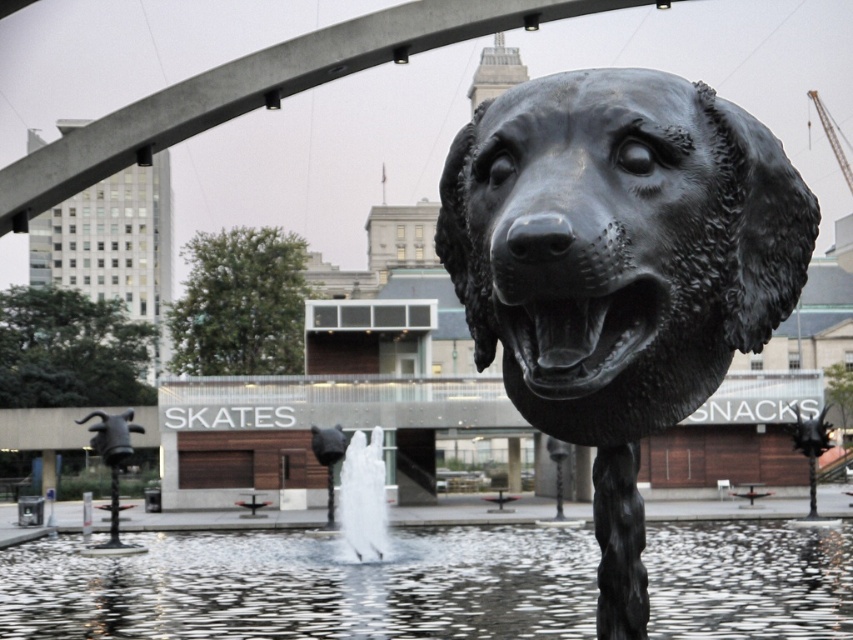
Question: Is black polished dog head at center bigger than white frothy water at center?

Choices:
 (A) no
 (B) yes

Answer: (A)

Question: Is black polished dog head at center wider than clear water at center?

Choices:
 (A) yes
 (B) no

Answer: (B)

Question: Which object is the closest to the clear water at center?

Choices:
 (A) white frothy water at center
 (B) black polished dog head at center

Answer: (A)

Question: Considering the real-world distances, which object is farthest from the white frothy water at center?

Choices:
 (A) black polished dog head at center
 (B) clear water at center

Answer: (A)

Question: Among these objects, which one is farthest from the camera?

Choices:
 (A) clear water at center
 (B) black polished dog head at center

Answer: (A)

Question: Can you confirm if clear water at center is bigger than white frothy water at center?

Choices:
 (A) no
 (B) yes

Answer: (B)